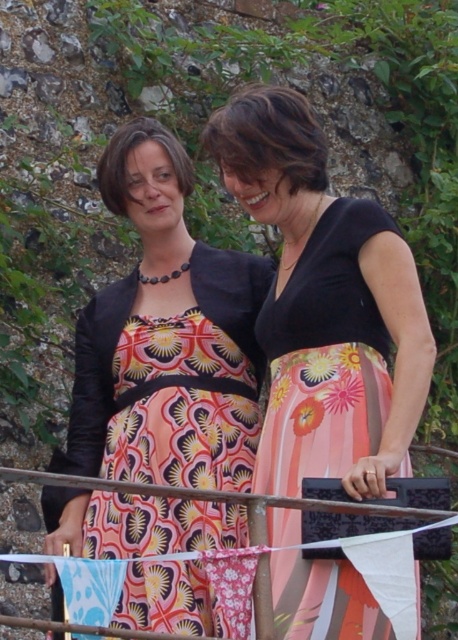
Question: Which point is closer to the camera?

Choices:
 (A) (156, 604)
 (B) (186, 490)
 (C) (387, 218)

Answer: (B)

Question: Can you confirm if matte black dress at center is thinner than black matte dress at center?

Choices:
 (A) no
 (B) yes

Answer: (A)

Question: Which point is closer to the camera taking this photo?

Choices:
 (A) (232, 378)
 (B) (103, 358)

Answer: (A)

Question: Where is black matte dress at center located in relation to printed fabric dress at center in the image?

Choices:
 (A) left
 (B) right

Answer: (B)

Question: Which of the following is the farthest from the observer?

Choices:
 (A) printed fabric dress at center
 (B) black matte dress at center

Answer: (A)

Question: Does matte black dress at center have a lesser width compared to black matte dress at center?

Choices:
 (A) yes
 (B) no

Answer: (B)